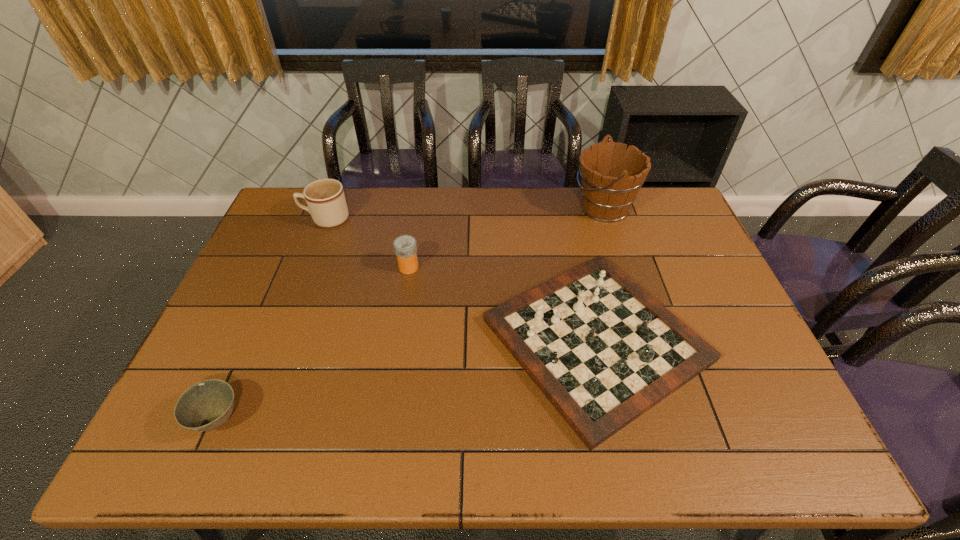
Locate an element on the screen. This screenshot has height=540, width=960. vacant point located between the shortest object and the third object from left to right is located at coordinates click(x=314, y=343).

This screenshot has height=540, width=960. Identify the location of free area in between the wine bucket and the shortest object. (411, 313).

Find the location of a particular element. free space between the mug and the bowl is located at coordinates (272, 319).

The height and width of the screenshot is (540, 960). I want to click on empty space that is in between the bowl and the third object from left to right, so click(x=314, y=343).

The image size is (960, 540). What are the coordinates of `free space between the mug and the shortest object` in the screenshot? It's located at (272, 319).

The width and height of the screenshot is (960, 540). What are the coordinates of `free area in between the mug and the bowl` in the screenshot? It's located at (272, 319).

The image size is (960, 540). Find the location of `empty location between the mug and the chessboard`. empty location between the mug and the chessboard is located at coordinates (461, 279).

Identify which object is located as the nearest to the third object from right to left. Please provide its 2D coordinates. Your answer should be formatted as a tuple, i.e. [(x, y)], where the tuple contains the x and y coordinates of a point satisfying the conditions above.

[(603, 351)]

The width and height of the screenshot is (960, 540). Identify the location of the fourth closest object to the wine bucket. (206, 405).

Where is `vacant region that satisfies the following two spatial constraints: 1. on the label side of the third object from left to right; 2. on the right side of the chessboard`? vacant region that satisfies the following two spatial constraints: 1. on the label side of the third object from left to right; 2. on the right side of the chessboard is located at coordinates (397, 340).